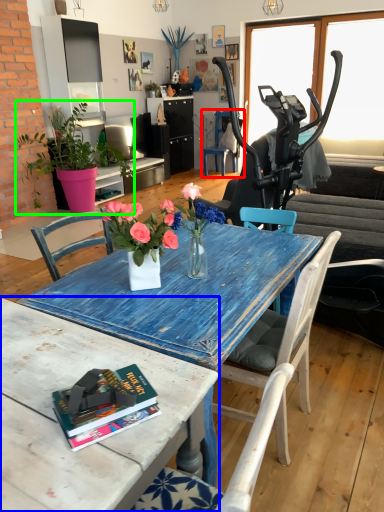
Question: Estimate the real-world distances between objects in this image. Which object is closer to chair (highlighted by a red box), table (highlighted by a blue box) or houseplant (highlighted by a green box)?

Choices:
 (A) table
 (B) houseplant

Answer: (B)